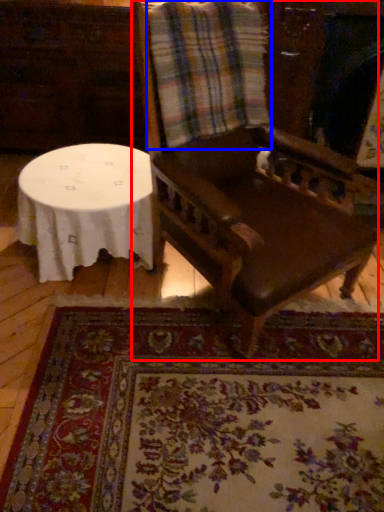
Question: Which object appears closest to the camera in this image, chair (highlighted by a red box) or flannel (highlighted by a blue box)?

Choices:
 (A) chair
 (B) flannel

Answer: (A)